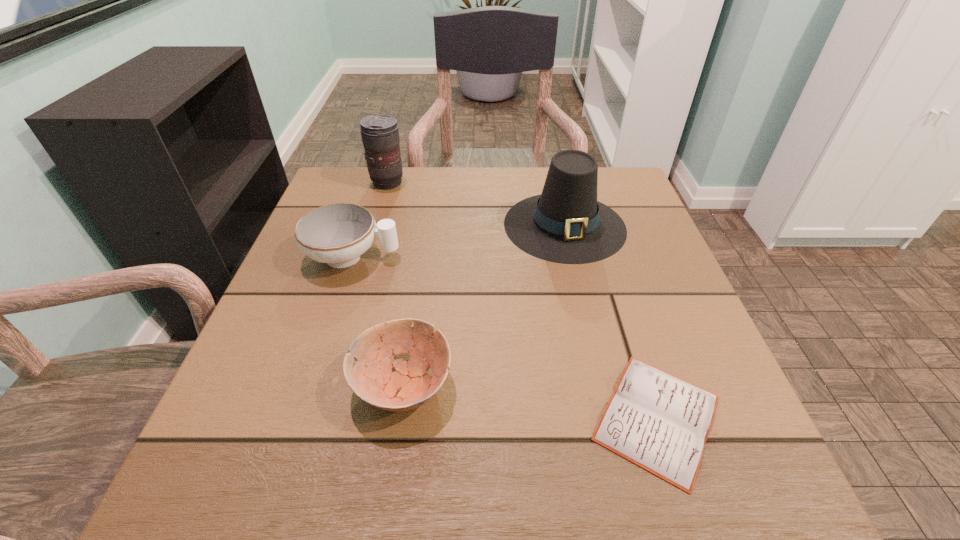
The image size is (960, 540). Find the location of `telephoto lens positioned at the far edge`. telephoto lens positioned at the far edge is located at coordinates (380, 135).

Locate an element on the screen. This screenshot has height=540, width=960. hat that is at the far edge is located at coordinates (565, 224).

Find the location of a particular element. The image size is (960, 540). object at the near edge is located at coordinates (659, 422).

Locate an element on the screen. The height and width of the screenshot is (540, 960). telephoto lens that is at the left edge is located at coordinates (380, 135).

I want to click on chinaware that is at the left edge, so click(x=338, y=234).

This screenshot has width=960, height=540. What are the coordinates of `hat positioned at the right edge` in the screenshot? It's located at [x=565, y=224].

Identify the location of diary that is at the right edge. (659, 422).

Where is `object that is at the far left corner`? The width and height of the screenshot is (960, 540). object that is at the far left corner is located at coordinates (380, 135).

At what (x,y) coordinates should I click in order to perform the action: click on object located at the far right corner. Please return your answer as a coordinate pair (x, y). Looking at the image, I should click on [565, 224].

The image size is (960, 540). I want to click on object that is positioned at the near right corner, so click(x=659, y=422).